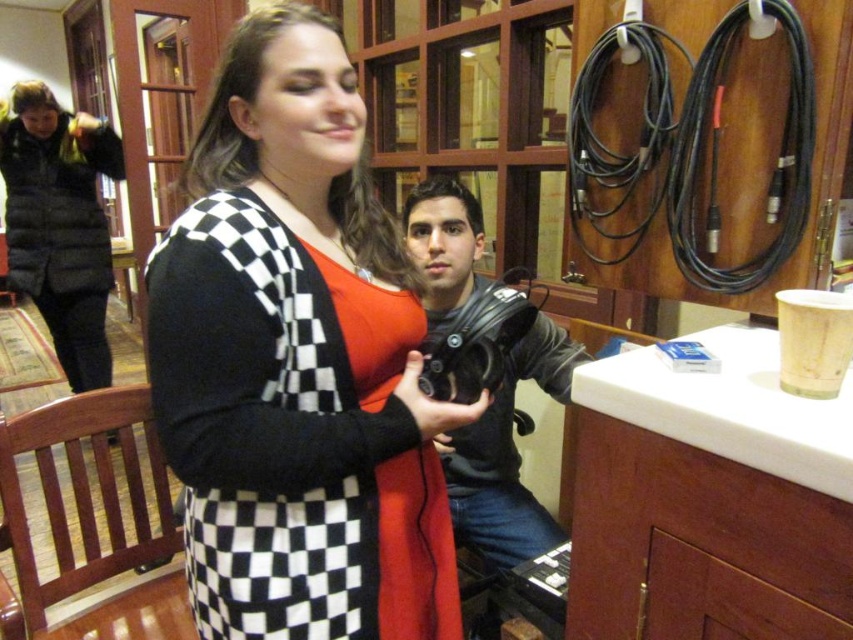
Is point (149, 332) more distant than point (32, 204)?

No, it is not.

The image size is (853, 640). What do you see at coordinates (297, 362) in the screenshot?
I see `black checkered sweater at center` at bounding box center [297, 362].

Does point (370, 608) lie in front of point (39, 188)?

Yes.

Where is `black checkered sweater at center`? black checkered sweater at center is located at coordinates (297, 362).

Is black checkered sweater at center to the right of matte black camera at center from the viewer's perspective?

Incorrect, black checkered sweater at center is not on the right side of matte black camera at center.

Is point (286, 449) more distant than point (467, 456)?

No, (286, 449) is closer to viewer.

Between point (320, 531) and point (543, 355), which one is positioned in front?

Point (320, 531) is in front.

Locate an element on the screen. Image resolution: width=853 pixels, height=640 pixels. black checkered sweater at center is located at coordinates (297, 362).

Between black puffer vest at left and matte black camera at center, which one appears on the right side from the viewer's perspective?

matte black camera at center is more to the right.

Is black puffer vest at left wider than matte black camera at center?

Indeed, black puffer vest at left has a greater width compared to matte black camera at center.

Is point (10, 120) positioned after point (479, 524)?

Yes, point (10, 120) is farther from viewer.

Locate an element on the screen. black puffer vest at left is located at coordinates (61, 224).